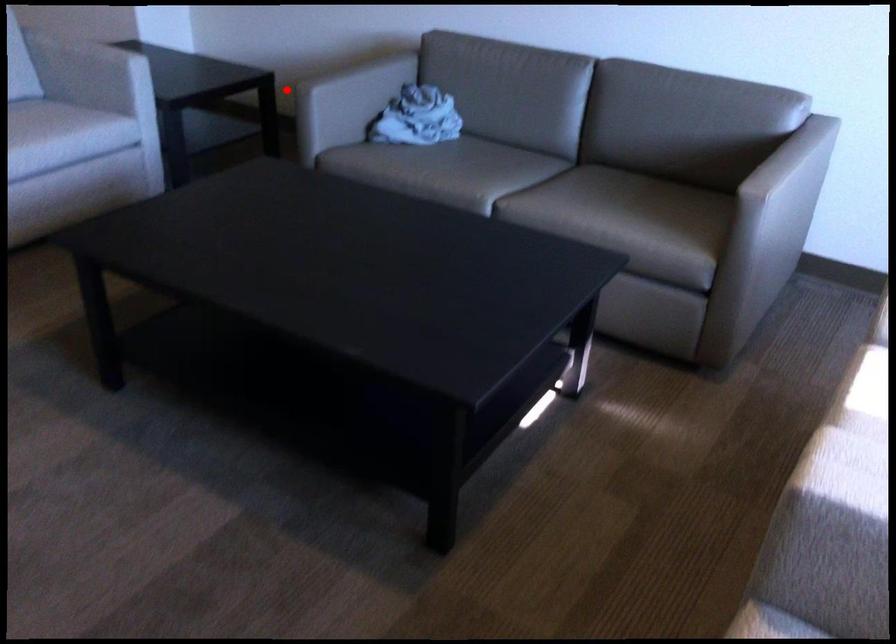
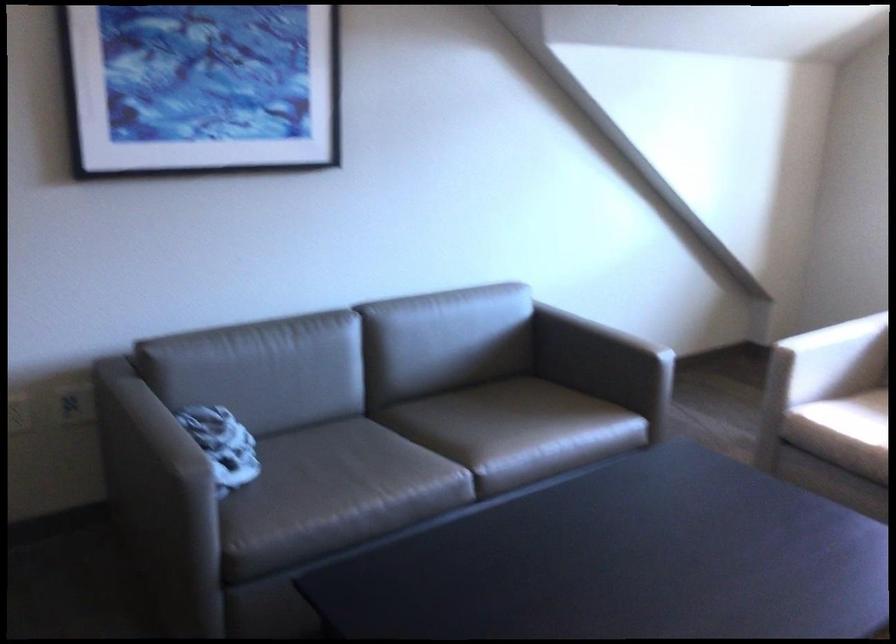
Question: I am providing you with two images of the same scene from different viewpoints. Image1 has a red point marked. In image2, the corresponding 3D location appears at what relative position? Reply with the corresponding letter.

Choices:
 (A) Closer
 (B) Farther

Answer: (A)